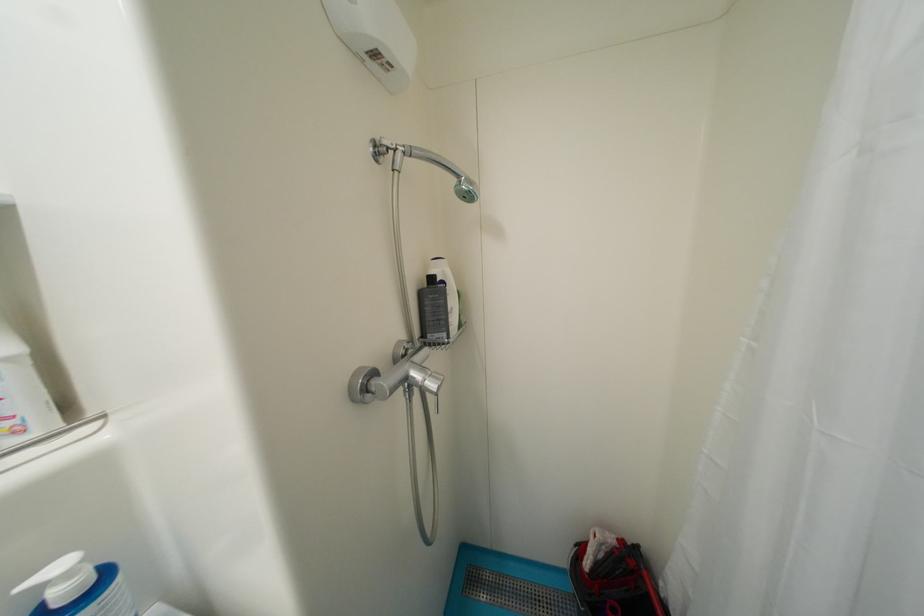
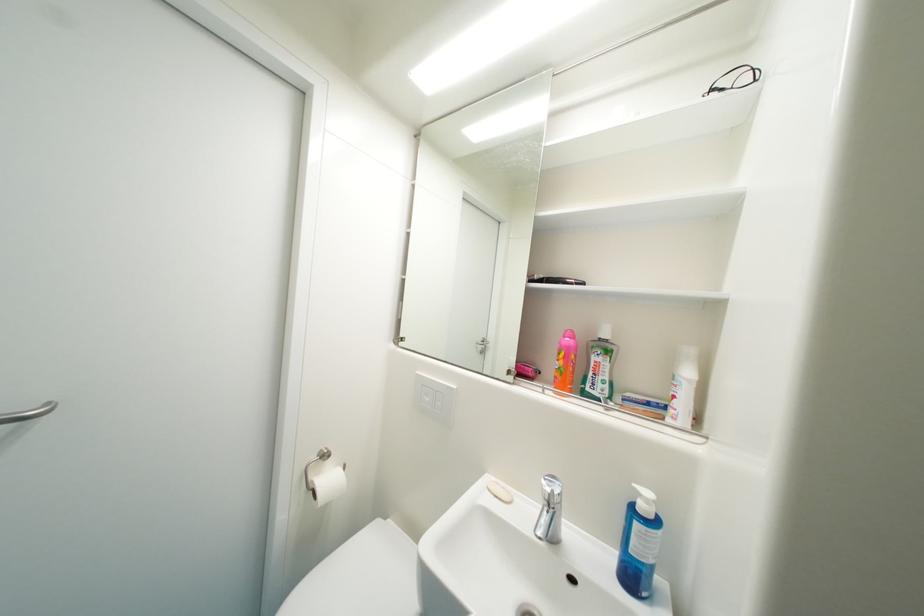
Question: The images are taken continuously from a first-person perspective. In which direction is your viewpoint rotating?

Choices:
 (A) Left
 (B) Right
 (C) Up
 (D) Down

Answer: (A)